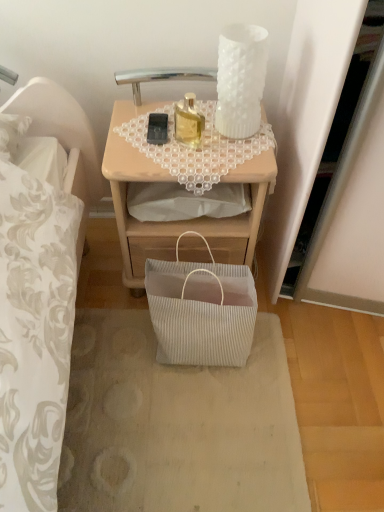
The width and height of the screenshot is (384, 512). Identify the location of free location in front of translucent glass bottle at center. (189, 161).